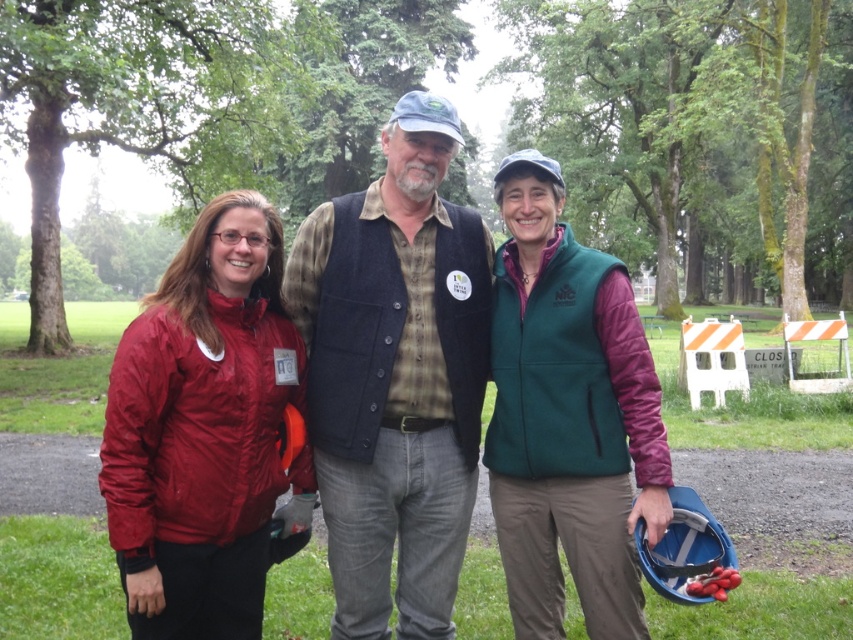
Is denim vest at center below matte red jacket at center?

No, denim vest at center is not below matte red jacket at center.

Consider the image. Between denim vest at center and matte red jacket at center, which one is positioned higher?

denim vest at center is higher up.

You are a GUI agent. You are given a task and a screenshot of the screen. Output one action in this format:
    pyautogui.click(x=<x>, y=<y>)
    Task: Click on the denim vest at center
    
    Given the screenshot: What is the action you would take?
    pyautogui.click(x=395, y=376)

Is matte red jacket at center positioned in front of green fleece vest at center?

Yes, it is.

Does matte red jacket at center have a lesser width compared to green fleece vest at center?

In fact, matte red jacket at center might be wider than green fleece vest at center.

Is point (137, 625) closer to viewer compared to point (618, 598)?

Yes, point (137, 625) is in front of point (618, 598).

The image size is (853, 640). I want to click on matte red jacket at center, so click(207, 433).

Which is more to the left, matte red jacket at left or denim vest at center?

matte red jacket at left

Looking at this image, does matte red jacket at left have a lesser width compared to denim vest at center?

Incorrect, matte red jacket at left's width is not less than denim vest at center's.

Is point (370, 499) closer to viewer compared to point (380, 362)?

No, (370, 499) is further to viewer.

This screenshot has height=640, width=853. In order to click on matte red jacket at left in this screenshot , I will do `click(395, 376)`.